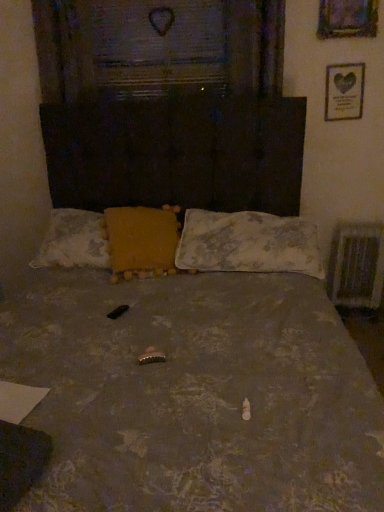
Question: Is wooden picture frame at upper right, positioned as the first picture frame in top-to-bottom order, far away from metallic silver radiator at right?

Choices:
 (A) no
 (B) yes

Answer: (B)

Question: Does wooden picture frame at upper right, acting as the 2th picture frame starting from the bottom, have a greater height compared to metallic silver radiator at right?

Choices:
 (A) yes
 (B) no

Answer: (B)

Question: Is wooden picture frame at upper right, positioned as the first picture frame in top-to-bottom order, at the right side of metallic silver radiator at right?

Choices:
 (A) yes
 (B) no

Answer: (B)

Question: Is wooden picture frame at upper right, which is the second picture frame from back to front, bigger than metallic silver radiator at right?

Choices:
 (A) no
 (B) yes

Answer: (A)

Question: Is the surface of wooden picture frame at upper right, acting as the 2th picture frame starting from the bottom, in direct contact with metallic silver radiator at right?

Choices:
 (A) yes
 (B) no

Answer: (B)

Question: Can you confirm if wooden picture frame at upper right, which ranks as the first picture frame in front-to-back order, is wider than metallic silver radiator at right?

Choices:
 (A) no
 (B) yes

Answer: (A)

Question: Considering the relative sizes of gold metallic picture frame at upper right, the second picture frame when ordered from top to bottom, and metallic silver radiator at right in the image provided, is gold metallic picture frame at upper right, the second picture frame when ordered from top to bottom, thinner than metallic silver radiator at right?

Choices:
 (A) no
 (B) yes

Answer: (B)

Question: Considering the relative sizes of gold metallic picture frame at upper right, which appears as the 1th picture frame when viewed from the back, and metallic silver radiator at right in the image provided, is gold metallic picture frame at upper right, which appears as the 1th picture frame when viewed from the back, taller than metallic silver radiator at right?

Choices:
 (A) no
 (B) yes

Answer: (A)

Question: Is gold metallic picture frame at upper right, which appears as the 1th picture frame when ordered from the bottom, smaller than metallic silver radiator at right?

Choices:
 (A) yes
 (B) no

Answer: (A)

Question: From a real-world perspective, is gold metallic picture frame at upper right, which appears as the 1th picture frame when ordered from the bottom, located higher than metallic silver radiator at right?

Choices:
 (A) yes
 (B) no

Answer: (A)

Question: Does gold metallic picture frame at upper right, which appears as the 1th picture frame when viewed from the back, come behind metallic silver radiator at right?

Choices:
 (A) yes
 (B) no

Answer: (B)

Question: Is metallic silver radiator at right at the back of gold metallic picture frame at upper right, arranged as the second picture frame when viewed from the front?

Choices:
 (A) no
 (B) yes

Answer: (A)

Question: Is yellow fabric pillow at center, placed as the first pillow when sorted from left to right, surrounding gold metallic picture frame at upper right, which appears as the 1th picture frame when viewed from the back?

Choices:
 (A) yes
 (B) no

Answer: (B)